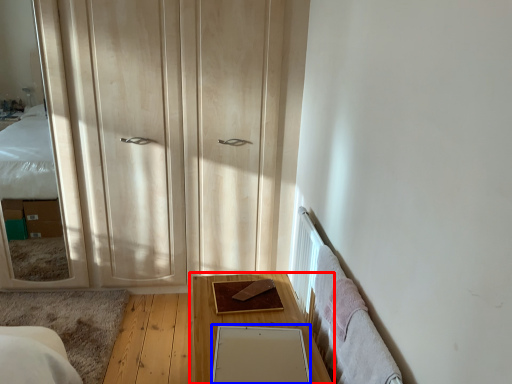
Question: Which point is further to the camera, table (highlighted by a red box) or mirror (highlighted by a blue box)?

Choices:
 (A) table
 (B) mirror

Answer: (A)